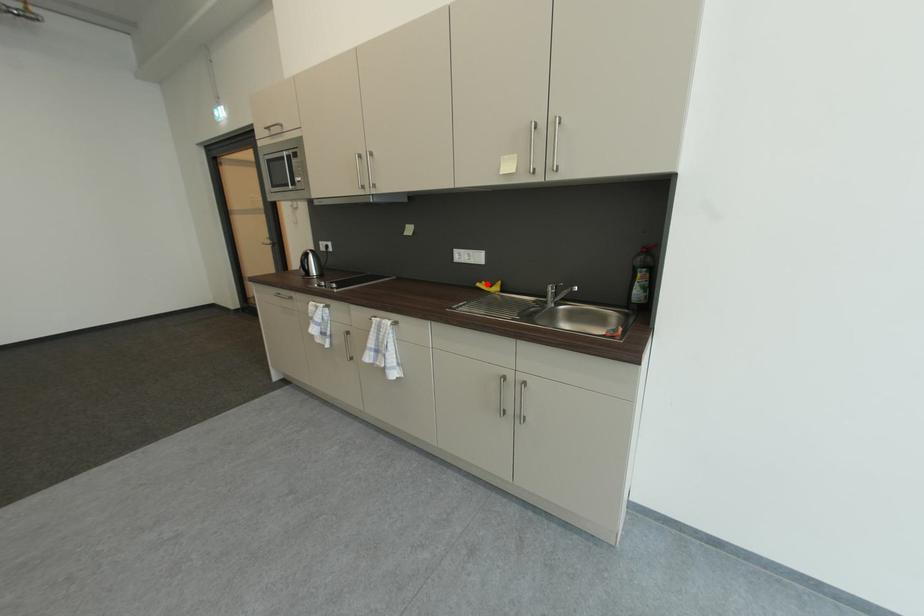
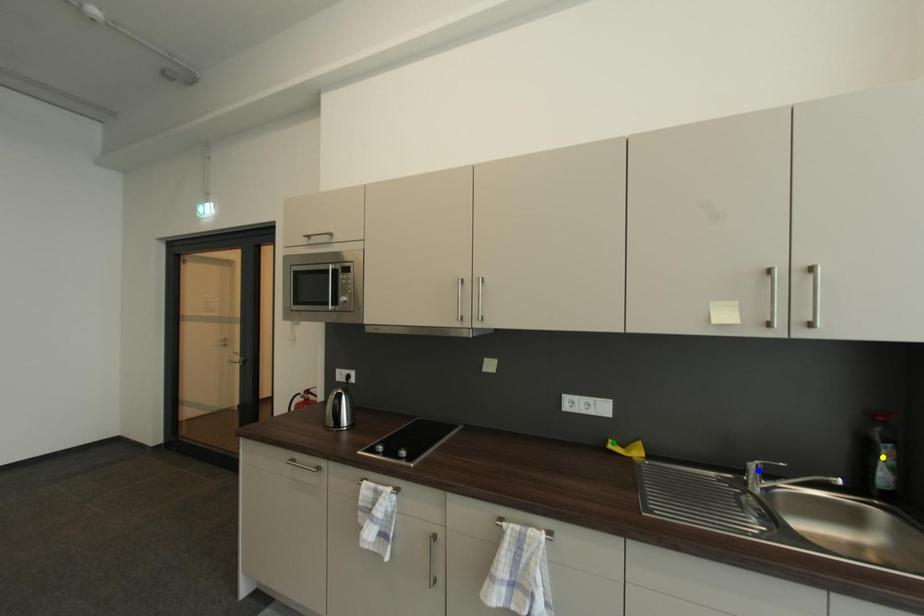
Question: I am providing you with two images of the same scene from different viewpoints. A red point is marked on the first image. You are given multiple points on the second image. Which point in image 2 represents the same 3d spot as the red point in image 1?

Choices:
 (A) green point
 (B) blue point
 (C) yellow point

Answer: (A)